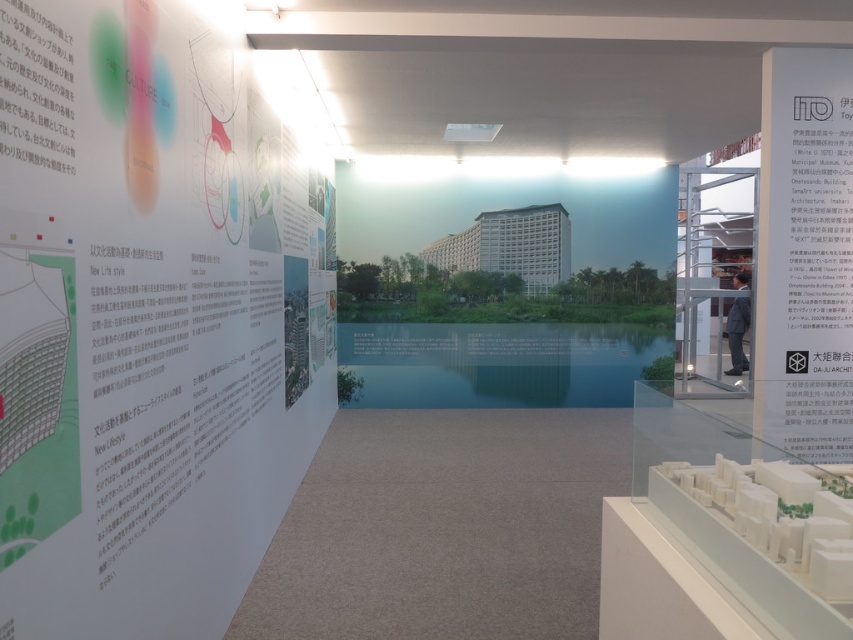
Question: Among these objects, which one is nearest to the camera?

Choices:
 (A) white matte poster at upper right
 (B) white paper at upper left

Answer: (B)

Question: In this image, where is white paper at upper left located relative to white matte poster at upper right?

Choices:
 (A) right
 (B) left

Answer: (B)

Question: Among these points, which one is farthest from the camera?

Choices:
 (A) (811, 321)
 (B) (167, 410)

Answer: (A)

Question: Which of the following is the farthest from the observer?

Choices:
 (A) white matte poster at upper right
 (B) white paper at upper left

Answer: (A)

Question: Can you confirm if white paper at upper left is smaller than white matte poster at upper right?

Choices:
 (A) no
 (B) yes

Answer: (B)

Question: Is white paper at upper left positioned in front of white matte poster at upper right?

Choices:
 (A) yes
 (B) no

Answer: (A)